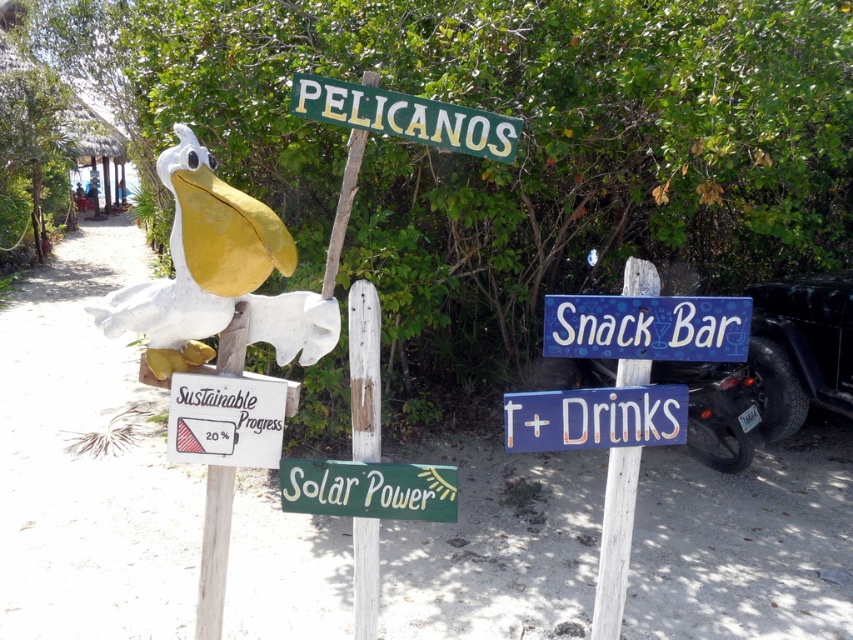
You are a visitor at the beach and want to take a photo of the blue painted wood sign at upper center and the white wood signpost at center. Which object should you focus on first if you want to capture both in a single frame without moving the camera?

The blue painted wood sign at upper center is much taller than the white wood signpost at center, so you should focus on the blue painted wood sign at upper center first to ensure it fits within the frame.

You are standing at the center of the scene and want to place a new sign exactly where the blue painted wood sign at upper center is located. What are the coordinates of the spot where you should place your new sign?

The coordinates for the blue painted wood sign at upper center are at point (614, 541), so you should place your new sign at those coordinates.